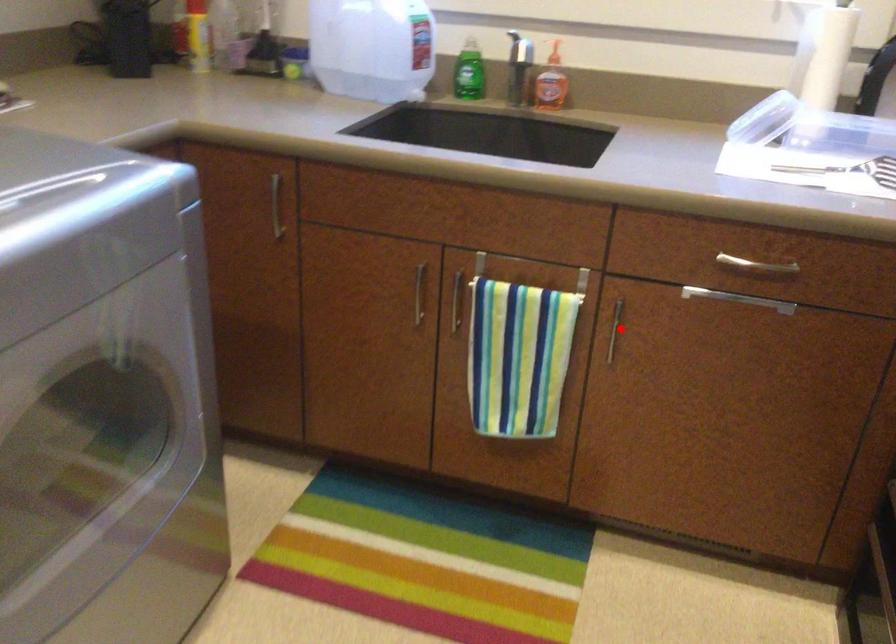
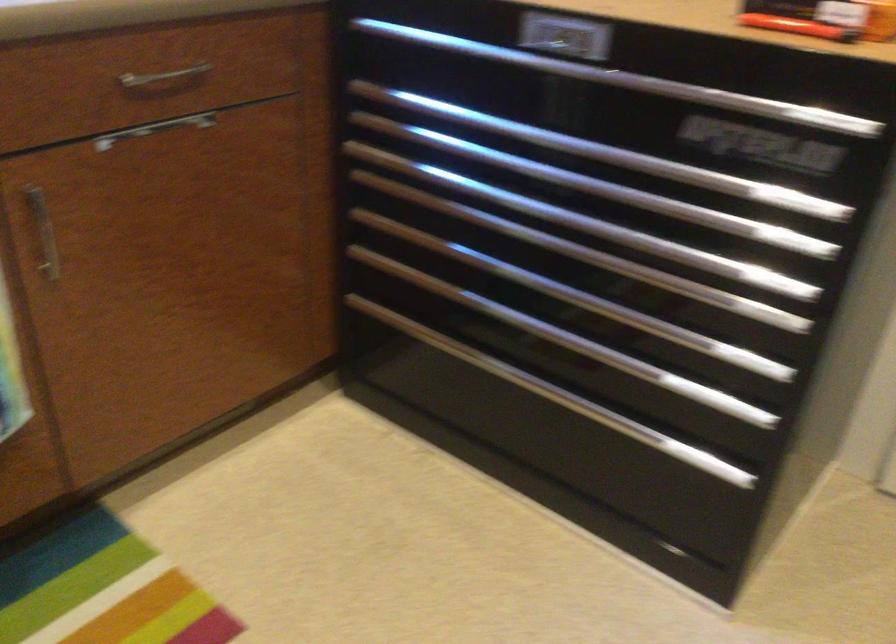
Question: A red point is marked in image1. In image2, is the corresponding 3D point closer to the camera or farther? Reply with the corresponding letter.

Choices:
 (A) The corresponding 3D point is closer.
 (B) The corresponding 3D point is farther.

Answer: (A)